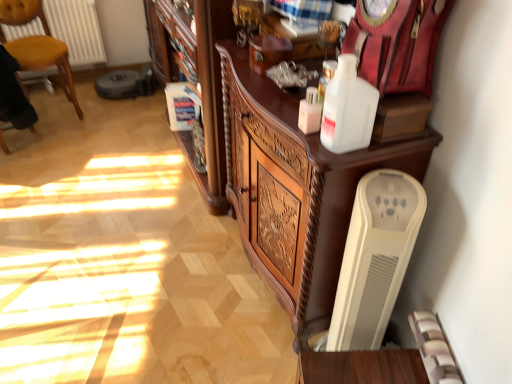
Locate an element on the screen. This screenshot has height=384, width=512. vacant space that is in between wooden cabinet at center and brown carved wood dresser at center is located at coordinates (230, 268).